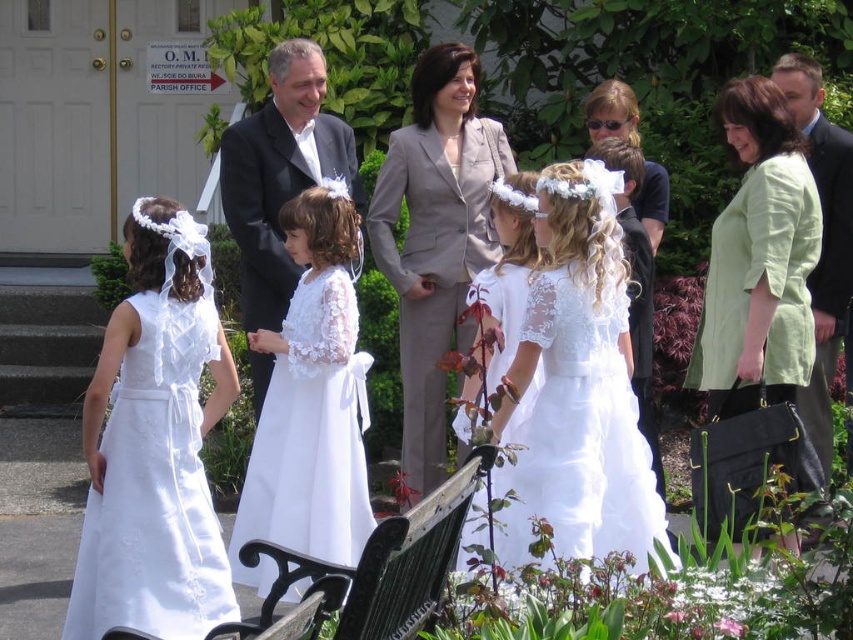
Question: Does white satin dress at center have a smaller size compared to green fabric jacket at upper right?

Choices:
 (A) yes
 (B) no

Answer: (A)

Question: Considering the real-world distances, which object is farthest from the black wrought iron bench at lower center?

Choices:
 (A) white lace dress at center
 (B) matte black suit at center
 (C) green fabric jacket at upper right

Answer: (B)

Question: Can you confirm if white lace dress at center is positioned to the left of matte black suit at center?

Choices:
 (A) yes
 (B) no

Answer: (B)

Question: Observing the image, what is the correct spatial positioning of white lace dress at center in reference to black wrought iron bench at lower center?

Choices:
 (A) right
 (B) left

Answer: (A)

Question: Among these objects, which one is nearest to the camera?

Choices:
 (A) white satin dress at left
 (B) green fabric jacket at upper right
 (C) white lace dress at center
 (D) matte black suit at center

Answer: (C)

Question: Considering the real-world distances, which object is farthest from the white lace dress at center?

Choices:
 (A) white satin dress at center
 (B) white satin dress at left
 (C) green fabric jacket at upper right
 (D) matte black suit at center

Answer: (D)